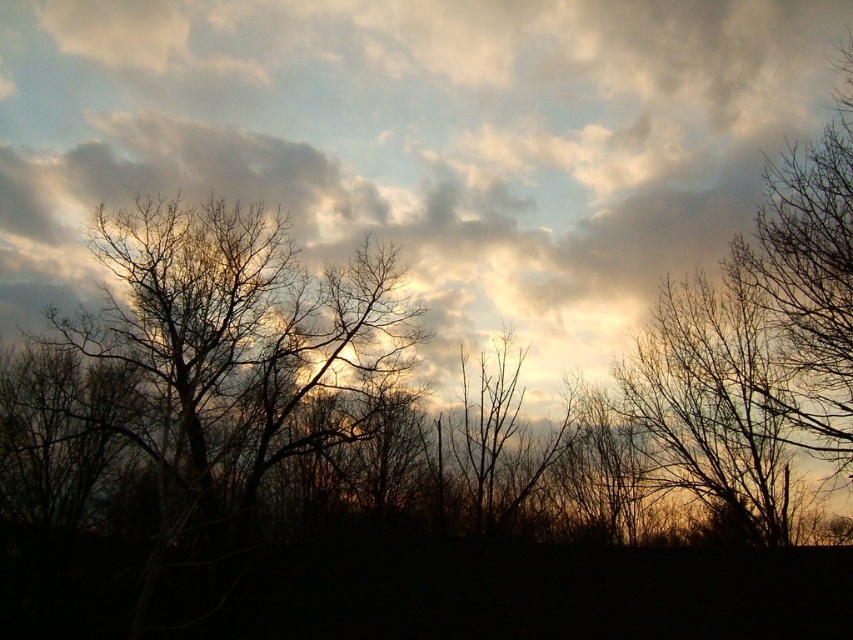
Question: Among these points, which one is farthest from the camera?

Choices:
 (A) (108, 308)
 (B) (299, 115)
 (C) (840, 180)

Answer: (B)

Question: Among these points, which one is nearest to the camera?

Choices:
 (A) (187, 384)
 (B) (732, 125)
 (C) (741, 273)

Answer: (C)

Question: Observing the image, what is the correct spatial positioning of cloudy sky at upper center in reference to brown leafless tree at center?

Choices:
 (A) above
 (B) below

Answer: (A)

Question: Which object appears farthest from the camera in this image?

Choices:
 (A) brown leafless tree at center
 (B) brown textured tree at upper right

Answer: (B)

Question: Can you confirm if cloudy sky at upper center is positioned to the right of brown textured tree at right?

Choices:
 (A) yes
 (B) no

Answer: (B)

Question: Is cloudy sky at upper center below brown textured tree at upper right?

Choices:
 (A) no
 (B) yes

Answer: (A)